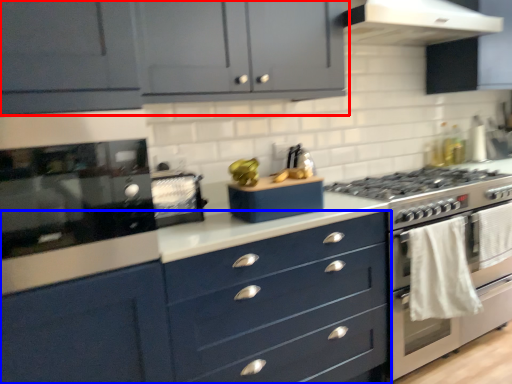
Question: Which object is further to the camera taking this photo, cabinetry (highlighted by a red box) or chest of drawers (highlighted by a blue box)?

Choices:
 (A) cabinetry
 (B) chest of drawers

Answer: (A)